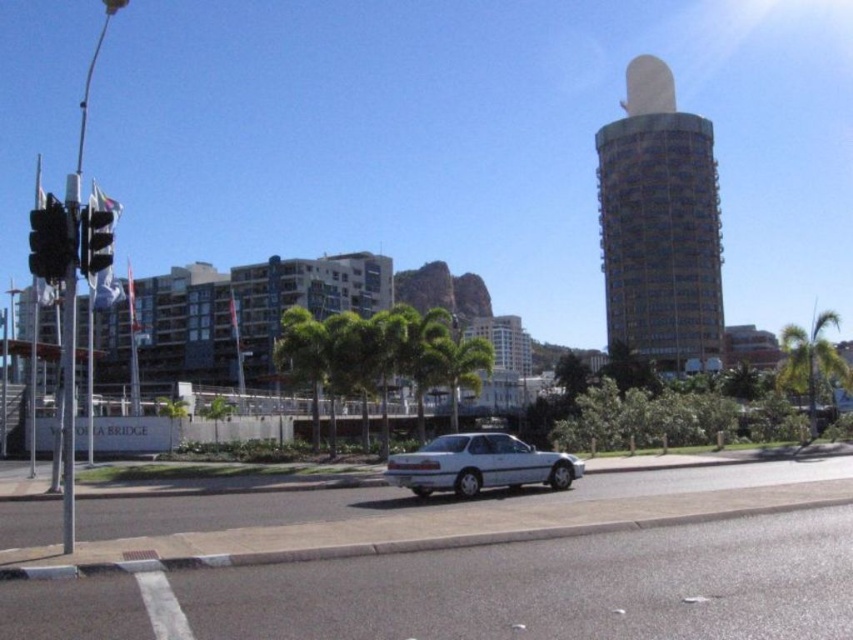
Question: Which object is the farthest from the white metallic car at center?

Choices:
 (A) green leafy palm tree at right
 (B) black plastic traffic light at left
 (C) metallic traffic light at left

Answer: (A)

Question: Which object appears farthest from the camera in this image?

Choices:
 (A) green leafy palm tree at right
 (B) white metallic car at center

Answer: (A)

Question: Which of these objects is positioned closest to the green leafy palm tree at right?

Choices:
 (A) black plastic traffic light at left
 (B) metallic traffic light at left
 (C) white metallic car at center
 (D) green leafy palm tree at center

Answer: (D)

Question: Can you confirm if white metallic car at center is bigger than metallic traffic light at left?

Choices:
 (A) no
 (B) yes

Answer: (B)

Question: Does white metallic car at center lie in front of green leafy palm tree at right?

Choices:
 (A) no
 (B) yes

Answer: (B)

Question: Does white metallic car at center have a greater width compared to metallic traffic light at left?

Choices:
 (A) no
 (B) yes

Answer: (B)